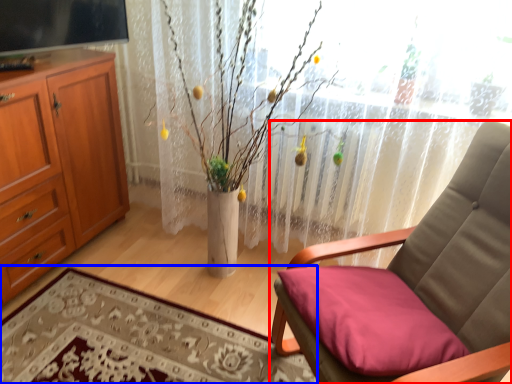
Question: Which point is further to the camera, chair (highlighted by a red box) or plain (highlighted by a blue box)?

Choices:
 (A) chair
 (B) plain

Answer: (B)